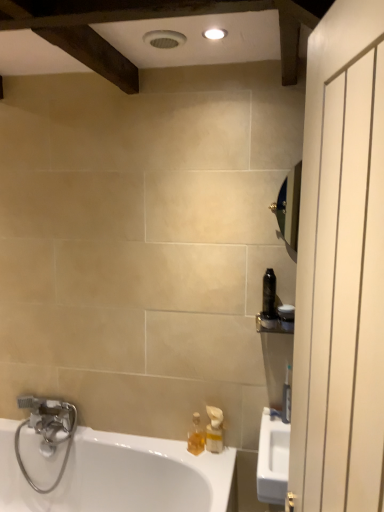
I want to click on black plastic bottle at right, acting as the 1th toiletry starting from the top, so click(x=269, y=294).

Measure the distance between point (357, 490) and camera.

Point (357, 490) is 21.73 inches from camera.

The image size is (384, 512). In order to click on translucent plastic soap dispenser at lower center, which is the 2th soap dispenser from right to left in this screenshot , I will do `click(196, 436)`.

This screenshot has height=512, width=384. Describe the element at coordinates (214, 430) in the screenshot. I see `translucent plastic soap dispenser at lower center, placed as the first soap dispenser when sorted from right to left` at that location.

Identify the location of translucent plastic soap dispenser at lower center, marked as the 2th soap dispenser in a left-to-right arrangement. (214, 430).

Measure the distance between white plastic toothbrush at right, the first toiletry when ordered from bottom to top, and camera.

The depth of white plastic toothbrush at right, the first toiletry when ordered from bottom to top, is 1.48 meters.

In order to face silver metallic faucet at lower left, should I rotate leftwards or rightwards?

You should rotate left by 18.845 degrees.

The width and height of the screenshot is (384, 512). What do you see at coordinates (47, 430) in the screenshot? I see `silver metallic faucet at lower left` at bounding box center [47, 430].

The image size is (384, 512). I want to click on black plastic bottle at right, acting as the 1th toiletry starting from the top, so click(269, 294).

How far apart are white glossy sink at right and silver metallic faucet at lower left?

The distance of white glossy sink at right from silver metallic faucet at lower left is 39.03 inches.

Considering the sizes of objects white glossy sink at right and silver metallic faucet at lower left in the image provided, who is wider, white glossy sink at right or silver metallic faucet at lower left?

With larger width is white glossy sink at right.

Choose the correct answer: Is white glossy sink at right inside silver metallic faucet at lower left or outside it?

white glossy sink at right is not enclosed by silver metallic faucet at lower left.

Would you say white glossy sink at right is to the left or to the right of silver metallic faucet at lower left in the picture?

white glossy sink at right is positioned on silver metallic faucet at lower left's right side.

Does point (286, 388) lie behind point (52, 419)?

No, it is not.

Is white plastic toothbrush at right, the first toiletry when ordered from bottom to top, at the right side of silver metallic faucet at lower left?

Yes, white plastic toothbrush at right, the first toiletry when ordered from bottom to top, is to the right of silver metallic faucet at lower left.

Which is in front, white plastic toothbrush at right, the 3th toiletry viewed from the top, or silver metallic faucet at lower left?

Positioned in front is white plastic toothbrush at right, the 3th toiletry viewed from the top.

From a real-world perspective, which is physically above, white plastic toothbrush at right, the 3th toiletry viewed from the top, or translucent plastic soap dispenser at lower center, marked as the 2th soap dispenser in a left-to-right arrangement?

In real-world perspective, white plastic toothbrush at right, the 3th toiletry viewed from the top, is above.

Is point (283, 407) positioned before point (211, 426)?

Yes, point (283, 407) is in front of point (211, 426).

Is translucent plastic soap dispenser at lower center, placed as the first soap dispenser when sorted from right to left, located within white plastic toothbrush at right, the first toiletry when ordered from bottom to top?

No, translucent plastic soap dispenser at lower center, placed as the first soap dispenser when sorted from right to left, is not inside white plastic toothbrush at right, the first toiletry when ordered from bottom to top.

Can you tell me how much black plastic toothbrush at right, which is the 2th toiletry in top-to-bottom order, and white matte screen door at right differ in facing direction?

78 degrees.

From a real-world perspective, is black plastic toothbrush at right, which is the 2th toiletry in top-to-bottom order, positioned under white matte screen door at right based on gravity?

Yes, from a real-world perspective, black plastic toothbrush at right, which is the 2th toiletry in top-to-bottom order, is beneath white matte screen door at right.

Considering the sizes of objects black plastic toothbrush at right, which ranks as the second toiletry in bottom-to-top order, and white matte screen door at right in the image provided, who is smaller, black plastic toothbrush at right, which ranks as the second toiletry in bottom-to-top order, or white matte screen door at right?

With smaller size is black plastic toothbrush at right, which ranks as the second toiletry in bottom-to-top order.

Is white glossy bathtub at lower left shorter than black plastic bottle at right, acting as the 1th toiletry starting from the top?

Incorrect, the height of white glossy bathtub at lower left does not fall short of that of black plastic bottle at right, acting as the 1th toiletry starting from the top.

Is white glossy bathtub at lower left in front of or behind black plastic bottle at right, acting as the 1th toiletry starting from the top, in the image?

In the image, white glossy bathtub at lower left appears in front of black plastic bottle at right, acting as the 1th toiletry starting from the top.

This screenshot has width=384, height=512. In the image, there is a black plastic bottle at right, acting as the 1th toiletry starting from the top. What are the coordinates of `bathtub below it (from the image's perspective)` in the screenshot? It's located at (103, 468).

Considering the points (287, 396) and (378, 211), which point is behind, point (287, 396) or point (378, 211)?

Positioned behind is point (287, 396).

In terms of width, does white plastic toothbrush at right, the 3th toiletry viewed from the top, look wider or thinner when compared to white matte screen door at right?

Considering their sizes, white plastic toothbrush at right, the 3th toiletry viewed from the top, looks slimmer than white matte screen door at right.

Between white plastic toothbrush at right, the first toiletry when ordered from bottom to top, and white matte screen door at right, which one has more height?

white matte screen door at right.

What's the angular difference between white plastic toothbrush at right, the first toiletry when ordered from bottom to top, and white matte screen door at right's facing directions?

129 degrees separate the facing orientations of white plastic toothbrush at right, the first toiletry when ordered from bottom to top, and white matte screen door at right.

Does black plastic toothbrush at right, which ranks as the second toiletry in bottom-to-top order, lie behind white glossy bathtub at lower left?

Yes, it is.

From the image's perspective, is black plastic toothbrush at right, which ranks as the second toiletry in bottom-to-top order, located above white glossy bathtub at lower left?

Yes, from the image's perspective, black plastic toothbrush at right, which ranks as the second toiletry in bottom-to-top order, is over white glossy bathtub at lower left.

Locate an element on the screen. bathtub below the black plastic toothbrush at right, which is the 2th toiletry in top-to-bottom order (from a real-world perspective) is located at coordinates (103, 468).

From a real-world perspective, is black plastic toothbrush at right, which is the 2th toiletry in top-to-bottom order, above or below white glossy bathtub at lower left?

black plastic toothbrush at right, which is the 2th toiletry in top-to-bottom order, is situated higher than white glossy bathtub at lower left in the real world.

In order to click on sink above the silver metallic faucet at lower left (from a real-world perspective) in this screenshot , I will do `click(273, 459)`.

Locate an element on the screen. The image size is (384, 512). toiletry that is the 1st one when counting forward from the silver metallic faucet at lower left is located at coordinates (287, 396).

Which object lies nearer to the anchor point white glossy bathtub at lower left, black plastic bottle at right, acting as the 1th toiletry starting from the top, or translucent plastic soap dispenser at lower center, marked as the 2th soap dispenser in a left-to-right arrangement?

translucent plastic soap dispenser at lower center, marked as the 2th soap dispenser in a left-to-right arrangement, lies closer to white glossy bathtub at lower left than the other object.

Estimate the real-world distances between objects in this image. Which object is closer to translucent plastic soap dispenser at lower center, placed as the first soap dispenser when sorted from right to left, white matte screen door at right or white plastic toothbrush at right, the first toiletry when ordered from bottom to top?

white plastic toothbrush at right, the first toiletry when ordered from bottom to top.

Looking at the image, which one is located further to translucent plastic soap dispenser at lower center, placed as the first soap dispenser when sorted from right to left, black plastic toothbrush at right, which ranks as the second toiletry in bottom-to-top order, or black plastic bottle at right, acting as the 1th toiletry starting from the top?

Among the two, black plastic bottle at right, acting as the 1th toiletry starting from the top, is located further to translucent plastic soap dispenser at lower center, placed as the first soap dispenser when sorted from right to left.

Based on their spatial positions, is translucent plastic soap dispenser at lower center, placed as the first soap dispenser when sorted from right to left, or translucent plastic soap dispenser at lower center, arranged as the first soap dispenser when viewed from the left, further from white plastic toothbrush at right, the 3th toiletry viewed from the top?

Among the two, translucent plastic soap dispenser at lower center, arranged as the first soap dispenser when viewed from the left, is located further to white plastic toothbrush at right, the 3th toiletry viewed from the top.

Looking at the image, which one is located closer to black plastic toothbrush at right, which is the 2th toiletry in top-to-bottom order, white glossy bathtub at lower left or black plastic bottle at right, the third toiletry positioned from the bottom?

black plastic bottle at right, the third toiletry positioned from the bottom, is positioned closer to the anchor black plastic toothbrush at right, which is the 2th toiletry in top-to-bottom order.

Estimate the real-world distances between objects in this image. Which object is further from white matte screen door at right, black plastic bottle at right, acting as the 1th toiletry starting from the top, or white glossy sink at right?

black plastic bottle at right, acting as the 1th toiletry starting from the top, is further to white matte screen door at right.

When comparing their distances from white glossy sink at right, does translucent plastic soap dispenser at lower center, placed as the first soap dispenser when sorted from right to left, or translucent plastic soap dispenser at lower center, arranged as the first soap dispenser when viewed from the left, seem further?

translucent plastic soap dispenser at lower center, arranged as the first soap dispenser when viewed from the left.

Based on their spatial positions, is white glossy bathtub at lower left or silver metallic faucet at lower left further from white glossy sink at right?

Based on the image, silver metallic faucet at lower left appears to be further to white glossy sink at right.

The height and width of the screenshot is (512, 384). I want to click on toiletry between black plastic toothbrush at right, which ranks as the second toiletry in bottom-to-top order, and translucent plastic soap dispenser at lower center, arranged as the first soap dispenser when viewed from the left, vertically, so click(x=287, y=396).

Where is `toiletry between silver metallic faucet at lower left and black plastic bottle at right, the third toiletry positioned from the bottom, from left to right`? toiletry between silver metallic faucet at lower left and black plastic bottle at right, the third toiletry positioned from the bottom, from left to right is located at coordinates (268, 321).

Where is `sink between black plastic toothbrush at right, which ranks as the second toiletry in bottom-to-top order, and white glossy bathtub at lower left from top to bottom`? The width and height of the screenshot is (384, 512). sink between black plastic toothbrush at right, which ranks as the second toiletry in bottom-to-top order, and white glossy bathtub at lower left from top to bottom is located at coordinates (273, 459).

Identify the location of sink between white matte screen door at right and white plastic toothbrush at right, the first toiletry when ordered from bottom to top, along the z-axis. (273, 459).